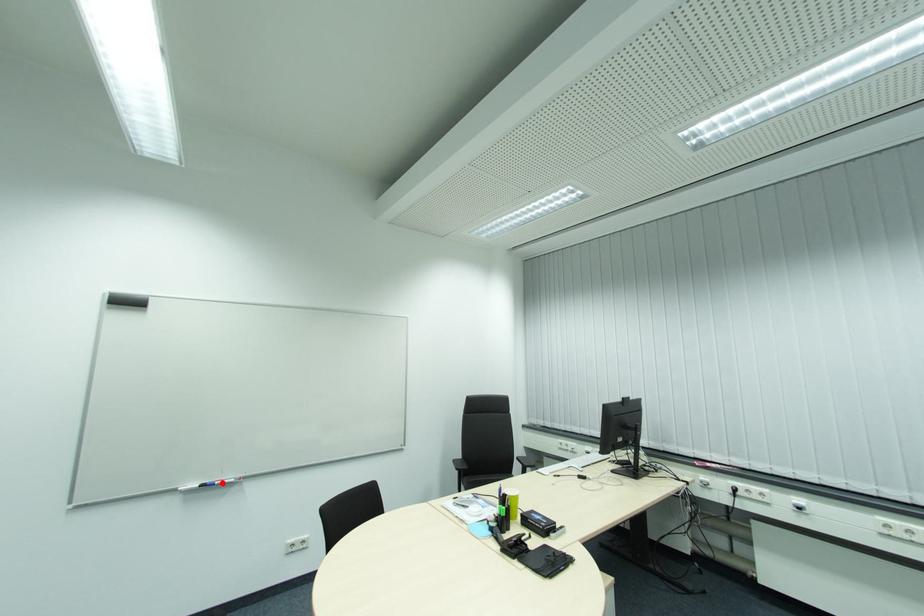
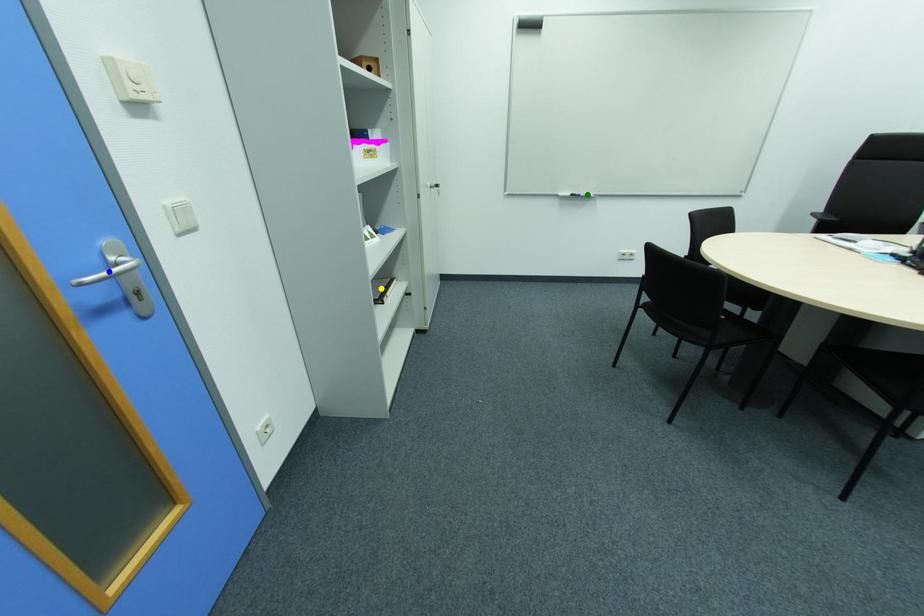
Question: I am providing you with two images of the same scene from different viewpoints. A red point is marked on the first image. You are given multiple points on the second image. Can you choose the point in image 2 that corresponds to the point in image 1?

Choices:
 (A) green point
 (B) blue point
 (C) yellow point

Answer: (A)